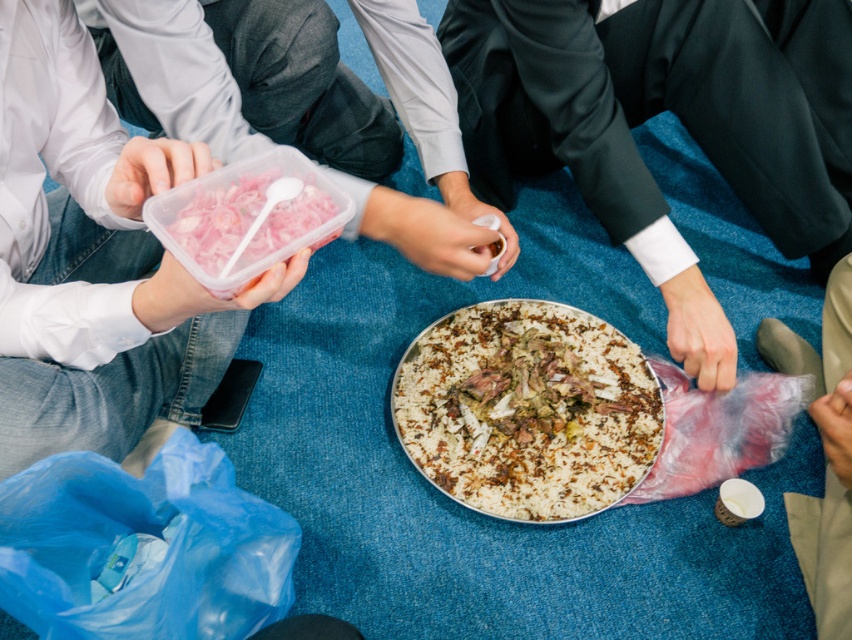
Question: Can you confirm if white rice with meat at center is positioned to the right of clear plastic bag at lower right?

Choices:
 (A) no
 (B) yes

Answer: (A)

Question: Which of the following is the closest to the observer?

Choices:
 (A) (227, 224)
 (B) (122, 356)
 (C) (560, 305)
 (D) (845, 368)

Answer: (A)

Question: Where is translucent plastic container at upper left located in relation to white rice with meat at center in the image?

Choices:
 (A) below
 (B) above

Answer: (B)

Question: Does translucent plastic container at upper left appear over clear plastic bag at lower right?

Choices:
 (A) yes
 (B) no

Answer: (A)

Question: Estimate the real-world distances between objects in this image. Which object is closer to the white rice with meat at center?

Choices:
 (A) clear plastic bag at lower right
 (B) translucent plastic container at upper left
 (C) translucent plastic container with pink shredded food at center

Answer: (A)

Question: Which object is the closest to the translucent plastic container with pink shredded food at center?

Choices:
 (A) translucent plastic container at upper left
 (B) white rice with meat at center

Answer: (A)